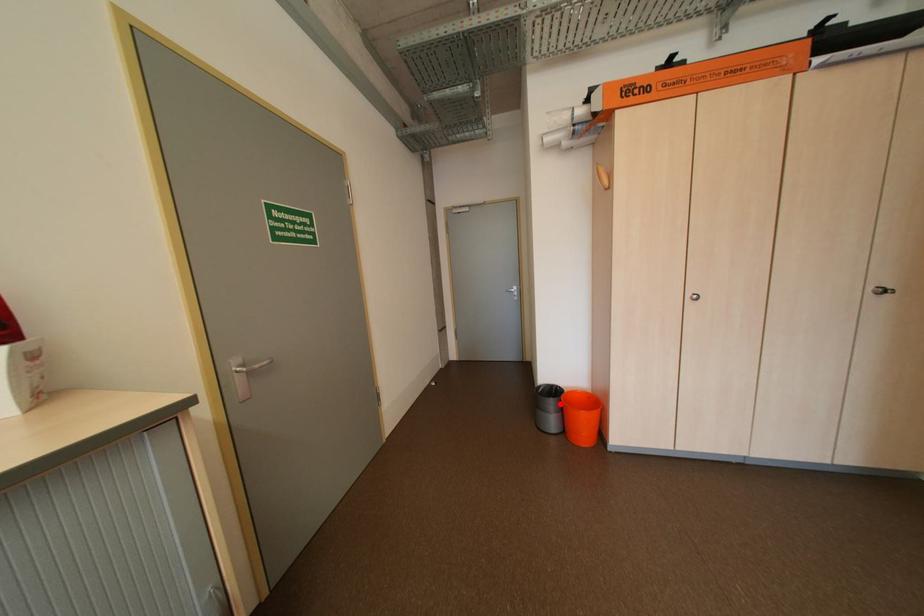
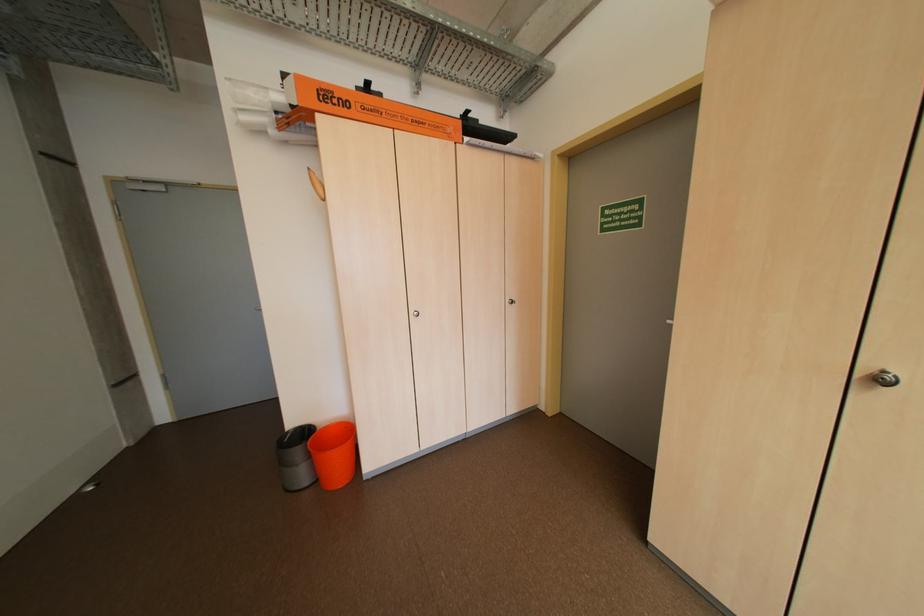
Where in the second image is the point corresponding to the highlighted location from the first image?

(307, 453)